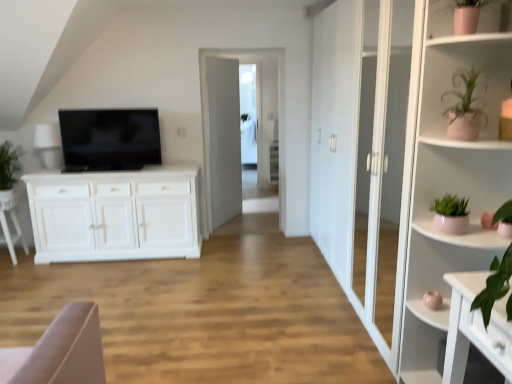
I want to click on white wood armchair at left, so click(7, 224).

The width and height of the screenshot is (512, 384). What do you see at coordinates (208, 107) in the screenshot? I see `transparent glass door at center` at bounding box center [208, 107].

Measure the distance between point (234,68) and camera.

The depth of point (234,68) is 5.20 meters.

The image size is (512, 384). Describe the element at coordinates (109, 139) in the screenshot. I see `matte black tv at center` at that location.

Identify the location of pink ceramic plant at upper right. pos(464,107).

From the image's perspective, is transparent glass door at center on top of pink ceramic plant at upper right?

Yes, from the image's perspective, transparent glass door at center is over pink ceramic plant at upper right.

Between transparent glass door at center and pink ceramic plant at upper right, which one is positioned behind?

transparent glass door at center is more distant.

Consider the image. Considering the positions of objects transparent glass door at center and pink ceramic plant at upper right in the image provided, who is more to the right, transparent glass door at center or pink ceramic plant at upper right?

pink ceramic plant at upper right.

In terms of width, does transparent glass door at center look wider or thinner when compared to pink ceramic plant at upper right?

Clearly, transparent glass door at center has less width compared to pink ceramic plant at upper right.

Considering the relative positions of pink ceramic vase at upper right, which is the first shelf in top-to-bottom order, and matte black tv at center in the image provided, is pink ceramic vase at upper right, which is the first shelf in top-to-bottom order, in front of matte black tv at center?

Yes, pink ceramic vase at upper right, which is the first shelf in top-to-bottom order, is in front of matte black tv at center.

Is pink ceramic vase at upper right, the 2th shelf in the bottom-to-top sequence, bigger than matte black tv at center?

No, pink ceramic vase at upper right, the 2th shelf in the bottom-to-top sequence, is not bigger than matte black tv at center.

Which of these two, pink ceramic vase at upper right, which is the first shelf in top-to-bottom order, or matte black tv at center, stands shorter?

pink ceramic vase at upper right, which is the first shelf in top-to-bottom order, is shorter.

Between point (487, 30) and point (115, 165), which one is positioned behind?

Positioned behind is point (115, 165).

Is there a large distance between transparent glass door at center and pink ceramic vase at upper right, the 2th shelf in the bottom-to-top sequence?

Yes, transparent glass door at center is far from pink ceramic vase at upper right, the 2th shelf in the bottom-to-top sequence.

Which of these two, transparent glass door at center or pink ceramic vase at upper right, which is the first shelf in top-to-bottom order, is thinner?

transparent glass door at center.

Is transparent glass door at center outside of pink ceramic vase at upper right, which is the first shelf in top-to-bottom order?

transparent glass door at center lies outside pink ceramic vase at upper right, which is the first shelf in top-to-bottom order,'s area.

Is white wood armchair at left facing towards matte black tv at center?

No, white wood armchair at left does not turn towards matte black tv at center.

Based on the photo, does white wood armchair at left appear on the left side of matte black tv at center?

Yes.

Is white wood armchair at left located outside matte black tv at center?

white wood armchair at left lies outside matte black tv at center's area.

Is pink ceramic plant at right, which is the first shelf in bottom-to-top order, wider or thinner than matte black tv at center?

Considering their sizes, pink ceramic plant at right, which is the first shelf in bottom-to-top order, looks broader than matte black tv at center.

Looking at this image, who is bigger, pink ceramic plant at right, which is the first shelf in bottom-to-top order, or matte black tv at center?

Bigger between the two is pink ceramic plant at right, which is the first shelf in bottom-to-top order.

What's the angular difference between pink ceramic plant at right, which is the first shelf in bottom-to-top order, and matte black tv at center's facing directions?

The angular difference between pink ceramic plant at right, which is the first shelf in bottom-to-top order, and matte black tv at center is 90.7 degrees.

Looking at this image, from a real-world perspective, relative to matte black tv at center, is pink ceramic plant at right, which is the first shelf in bottom-to-top order, vertically above or below?

Clearly, from a real-world perspective, pink ceramic plant at right, which is the first shelf in bottom-to-top order, is below matte black tv at center.

Which of these two, matte black tv at center or pink ceramic vase at upper right, the 2th shelf in the bottom-to-top sequence, is smaller?

pink ceramic vase at upper right, the 2th shelf in the bottom-to-top sequence, is smaller.

From a real-world perspective, who is located lower, matte black tv at center or pink ceramic vase at upper right, which is the first shelf in top-to-bottom order?

matte black tv at center, from a real-world perspective.

Is matte black tv at center inside the boundaries of pink ceramic vase at upper right, the 2th shelf in the bottom-to-top sequence, or outside?

matte black tv at center lies outside pink ceramic vase at upper right, the 2th shelf in the bottom-to-top sequence.

Is matte black tv at center far from pink ceramic vase at upper right, the 2th shelf in the bottom-to-top sequence?

Yes, matte black tv at center is far from pink ceramic vase at upper right, the 2th shelf in the bottom-to-top sequence.

From the picture: From the image's perspective, is pink ceramic plant at right, which is the first shelf in bottom-to-top order, under pink ceramic plant at upper right?

Correct, pink ceramic plant at right, which is the first shelf in bottom-to-top order, appears lower than pink ceramic plant at upper right in the image.

Locate an element on the screen. The image size is (512, 384). shelf on the right of pink ceramic plant at upper right is located at coordinates (446, 176).

How many degrees apart are the facing directions of pink ceramic plant at right, which is the first shelf in bottom-to-top order, and pink ceramic plant at upper right?

The angular difference between pink ceramic plant at right, which is the first shelf in bottom-to-top order, and pink ceramic plant at upper right is 19 degrees.

Locate an element on the screen. The width and height of the screenshot is (512, 384). glass door below the pink ceramic plant at upper right (from a real-world perspective) is located at coordinates (208, 107).

Identify the location of television behind the pink ceramic vase at upper right, the 2th shelf in the bottom-to-top sequence. This screenshot has width=512, height=384. (109, 139).

Looking at the image, which one is located further to pink ceramic plant at right, which is the 2th shelf from top to bottom, white wood armchair at left or white wooden door at center?

white wood armchair at left is further to pink ceramic plant at right, which is the 2th shelf from top to bottom.

Based on their spatial positions, is transparent glass door at center or pink ceramic vase at upper right, the 2th shelf in the bottom-to-top sequence, closer to white wooden door at center?

Based on the image, transparent glass door at center appears to be nearer to white wooden door at center.

Looking at the image, which one is located closer to pink ceramic plant at right, which is the 2th shelf from top to bottom, transparent glass door at center or pink ceramic vase at upper right, which is the first shelf in top-to-bottom order?

pink ceramic vase at upper right, which is the first shelf in top-to-bottom order, is closer to pink ceramic plant at right, which is the 2th shelf from top to bottom.

Looking at the image, which one is located closer to transparent glass door at center, pink ceramic plant at upper right or matte black tv at center?

Based on the image, matte black tv at center appears to be nearer to transparent glass door at center.

Consider the image. Considering their positions, is pink ceramic plant at upper right positioned closer to pink ceramic vase at upper right, which is the first shelf in top-to-bottom order, than pink ceramic plant at right, which is the first shelf in bottom-to-top order?

The object closer to pink ceramic vase at upper right, which is the first shelf in top-to-bottom order, is pink ceramic plant at upper right.

Estimate the real-world distances between objects in this image. Which object is closer to white wood armchair at left, pink ceramic vase at upper right, which is the first shelf in top-to-bottom order, or white wooden door at center?

white wooden door at center is closer to white wood armchair at left.

Consider the image. Estimate the real-world distances between objects in this image. Which object is further from transparent glass door at center, pink ceramic vase at upper right, the 2th shelf in the bottom-to-top sequence, or pink ceramic plant at right, which is the 2th shelf from top to bottom?

Among the two, pink ceramic vase at upper right, the 2th shelf in the bottom-to-top sequence, is located further to transparent glass door at center.

From the image, which object appears to be farther from white wood armchair at left, matte black tv at center or white wooden door at center?

The object further to white wood armchair at left is white wooden door at center.

Find the location of a particular element. The image size is (512, 384). houseplant between pink ceramic vase at upper right, which is the first shelf in top-to-bottom order, and white wooden door at center from front to back is located at coordinates (464, 107).

You are a GUI agent. You are given a task and a screenshot of the screen. Output one action in this format:
    pyautogui.click(x=<x>, y=<y>)
    Task: Click on the television between pink ceramic plant at right, which is the 2th shelf from top to bottom, and transparent glass door at center, along the z-axis
    This screenshot has width=512, height=384.
    Given the screenshot: What is the action you would take?
    pyautogui.click(x=109, y=139)

You are a GUI agent. You are given a task and a screenshot of the screen. Output one action in this format:
    pyautogui.click(x=<x>, y=<y>)
    Task: Click on the door between white wood armchair at left and pink ceramic vase at upper right, the 2th shelf in the bottom-to-top sequence, from left to right
    The image size is (512, 384).
    Given the screenshot: What is the action you would take?
    pyautogui.click(x=222, y=141)

Where is `door between white wood armchair at left and pink ceramic plant at right, which is the first shelf in bottom-to-top order, in the horizontal direction`? Image resolution: width=512 pixels, height=384 pixels. door between white wood armchair at left and pink ceramic plant at right, which is the first shelf in bottom-to-top order, in the horizontal direction is located at coordinates (222, 141).